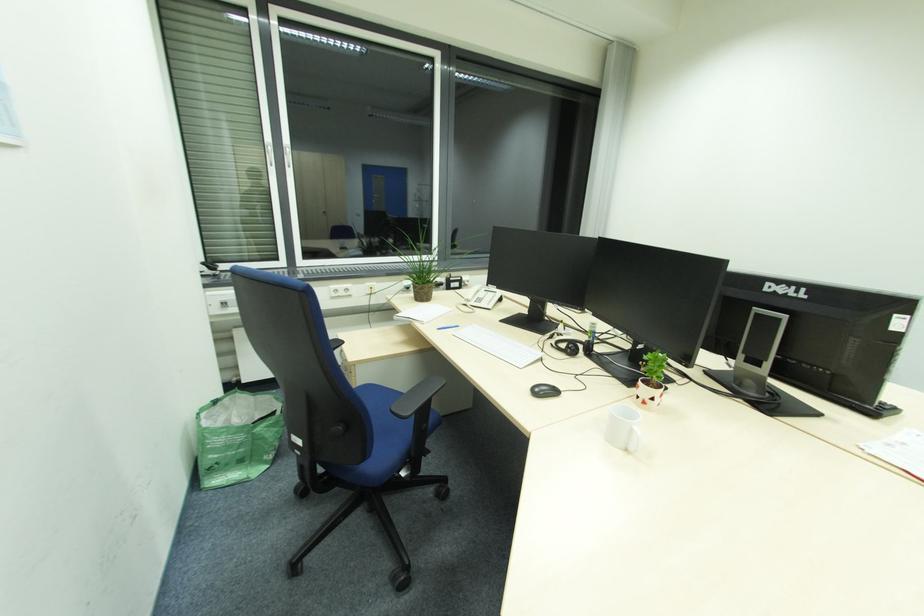
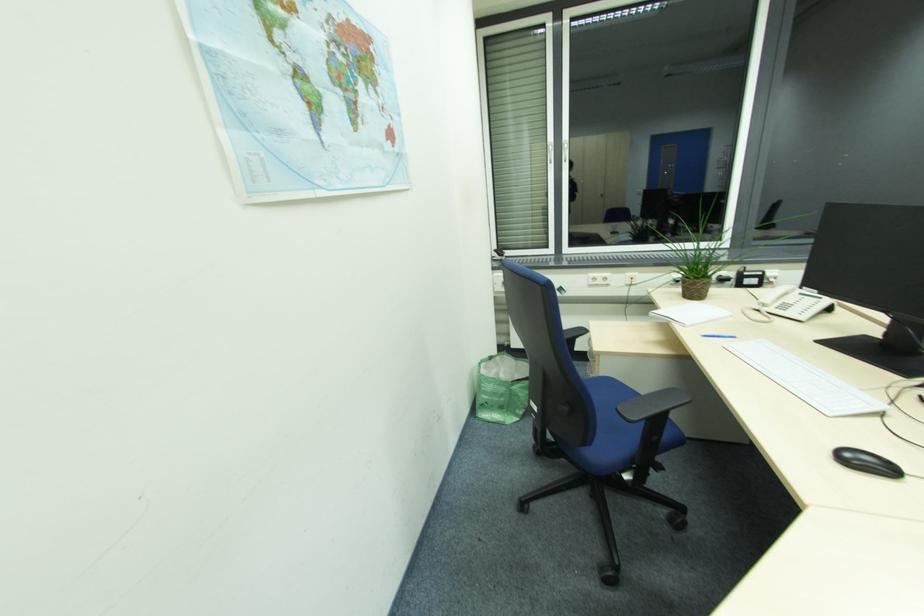
Question: The images are taken continuously from a first-person perspective. In which direction is your viewpoint rotating?

Choices:
 (A) Left
 (B) Right
 (C) Up
 (D) Down

Answer: (A)